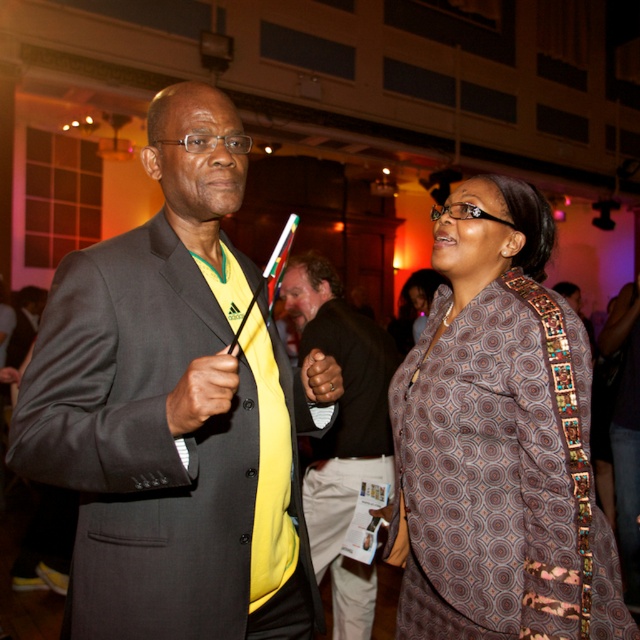
Question: Among these points, which one is nearest to the camera?

Choices:
 (A) (554, 298)
 (B) (376, 452)
 (C) (243, 490)

Answer: (C)

Question: Considering the relative positions of matte black suit at center and brown printed fabric dress at right in the image provided, where is matte black suit at center located with respect to brown printed fabric dress at right?

Choices:
 (A) below
 (B) above

Answer: (B)

Question: Is matte black suit at center smaller than brown printed fabric dress at right?

Choices:
 (A) no
 (B) yes

Answer: (B)

Question: Among these points, which one is farthest from the camera?

Choices:
 (A) (307, 298)
 (B) (310, 356)
 (C) (486, 524)

Answer: (A)

Question: Which point is closer to the camera taking this photo?

Choices:
 (A) (536, 364)
 (B) (360, 621)
 (C) (208, 84)

Answer: (C)

Question: Is matte black suit at center bigger than yellow fabric shirt at center?

Choices:
 (A) yes
 (B) no

Answer: (B)